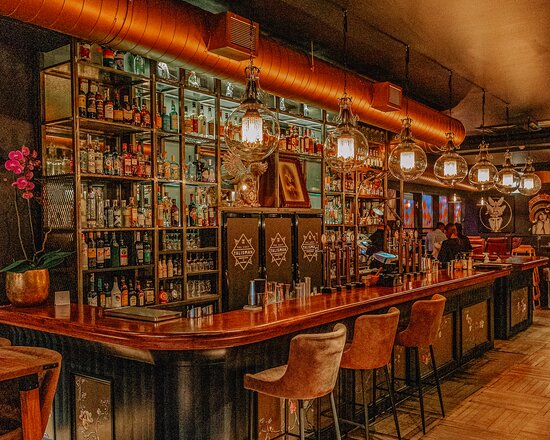
Find the location of `white lights`. white lights is located at coordinates (253, 134), (348, 149), (407, 159), (451, 172), (482, 175), (506, 181), (525, 183).